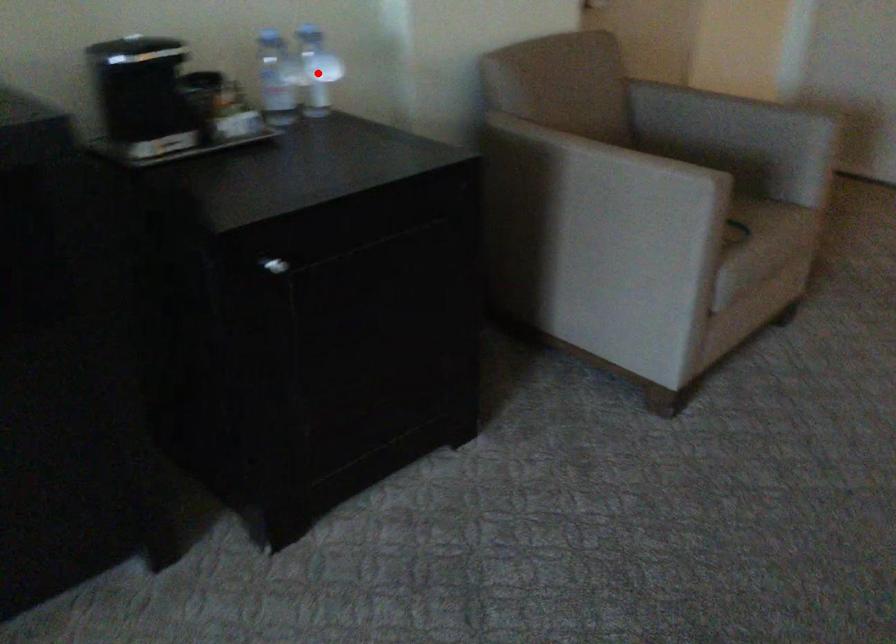
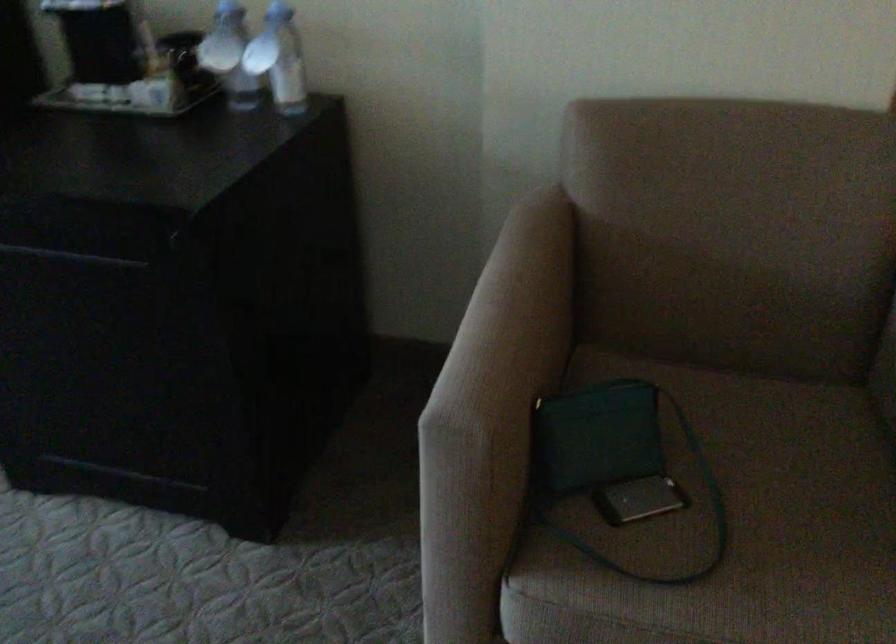
Question: I am providing you with two images of the same scene from different viewpoints. A red point is marked on the first image. At the location where the point appears in image 1, is it still visible in image 2?

Choices:
 (A) Yes
 (B) No

Answer: (A)